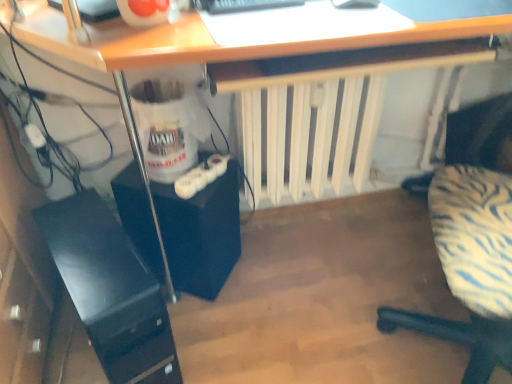
Question: From the image's perspective, is zebra-patterned fabric chair at right located above or below white matte radiator at center?

Choices:
 (A) below
 (B) above

Answer: (A)

Question: Is zebra-patterned fabric chair at right wider or thinner than white matte radiator at center?

Choices:
 (A) thin
 (B) wide

Answer: (B)

Question: Estimate the real-world distances between objects in this image. Which object is closer to the black glossy computer tower at lower left, which is the first computer tower in left-to-right order?

Choices:
 (A) white matte radiator at center
 (B) zebra-patterned fabric chair at right
 (C) black matte computer tower at lower left, the 1th computer tower viewed from the right

Answer: (C)

Question: Considering the real-world distances, which object is closest to the black glossy computer tower at lower left, which is the second computer tower from right to left?

Choices:
 (A) white matte radiator at center
 (B) zebra-patterned fabric chair at right
 (C) black matte computer tower at lower left, the second computer tower in the left-to-right sequence

Answer: (C)